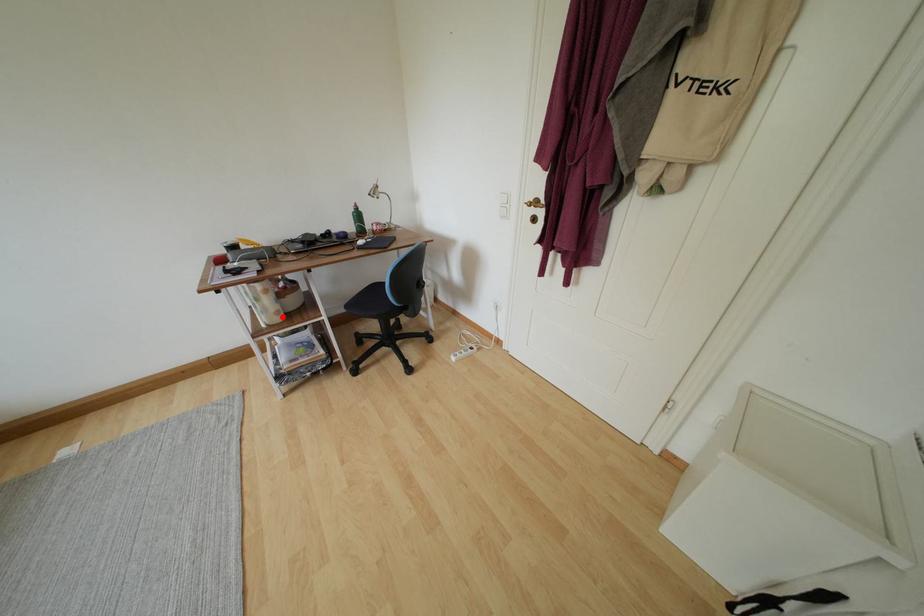
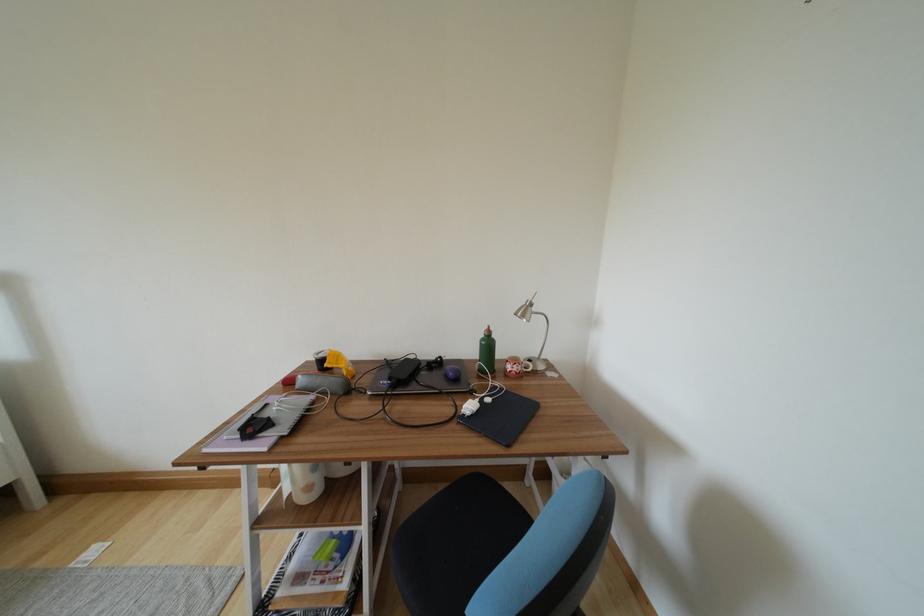
Find the pixel in the second image that matches the highlighted location in the first image.

(313, 492)